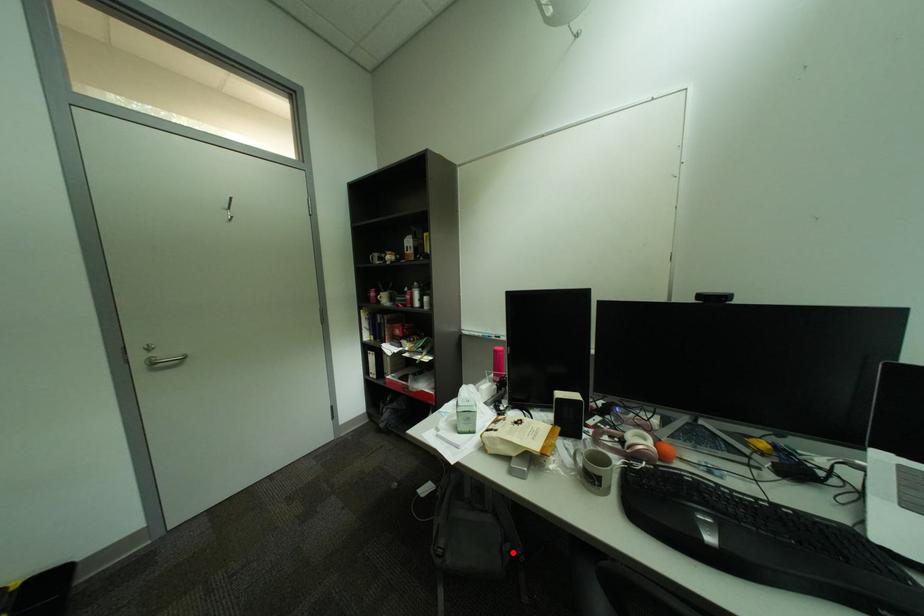
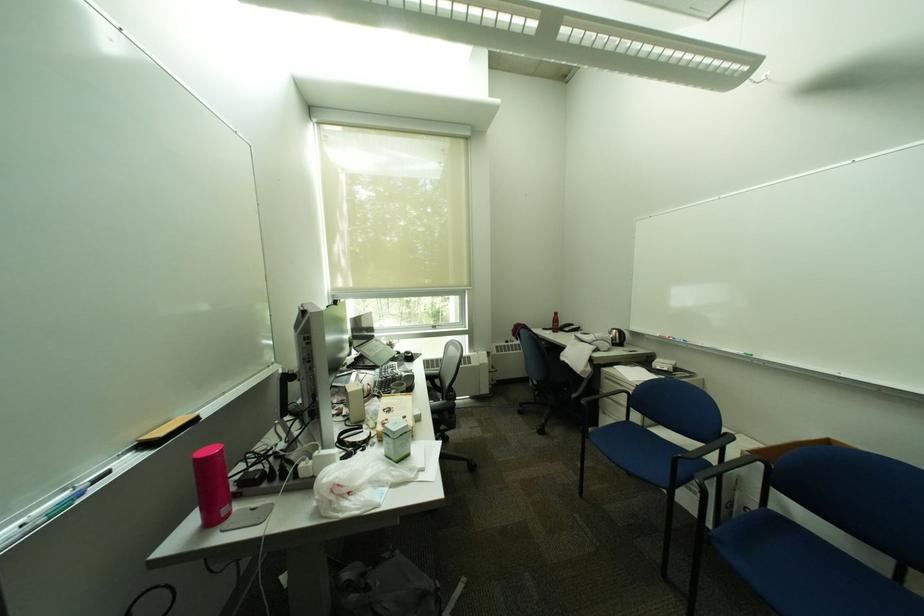
Where in the second image is the point corresponding to the highlighted location from the first image?

(400, 560)